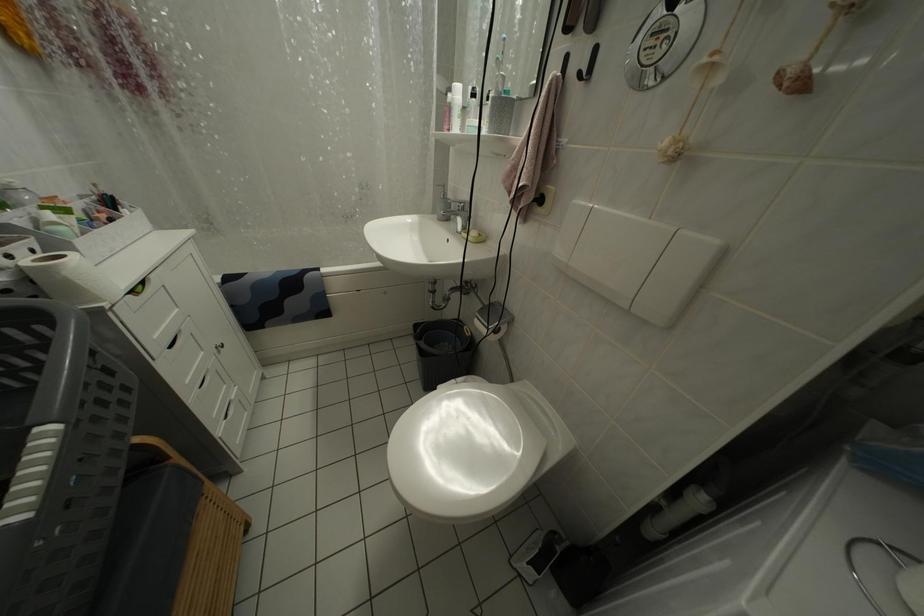
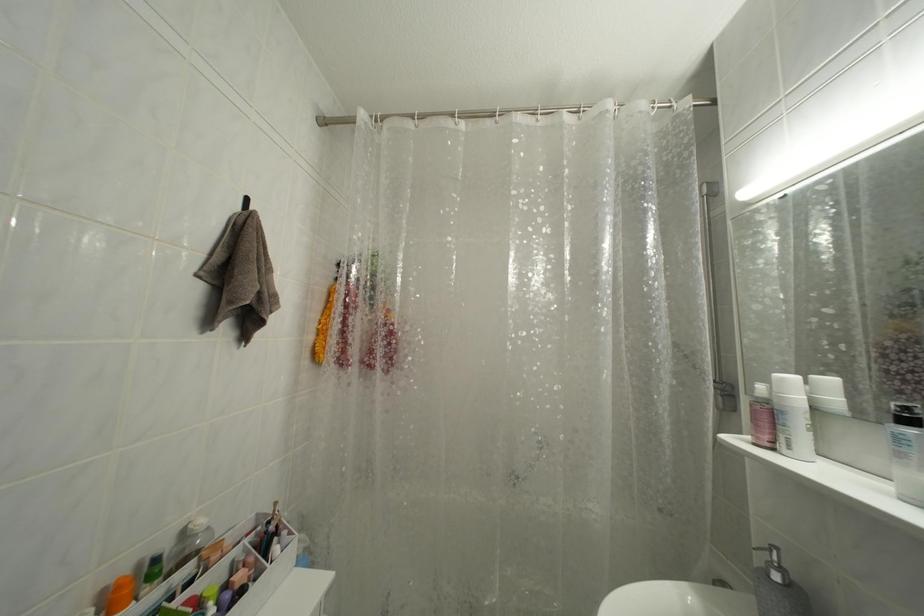
First-person continuous shooting, in which direction is the camera rotating?

The camera's rotation is toward left-up.